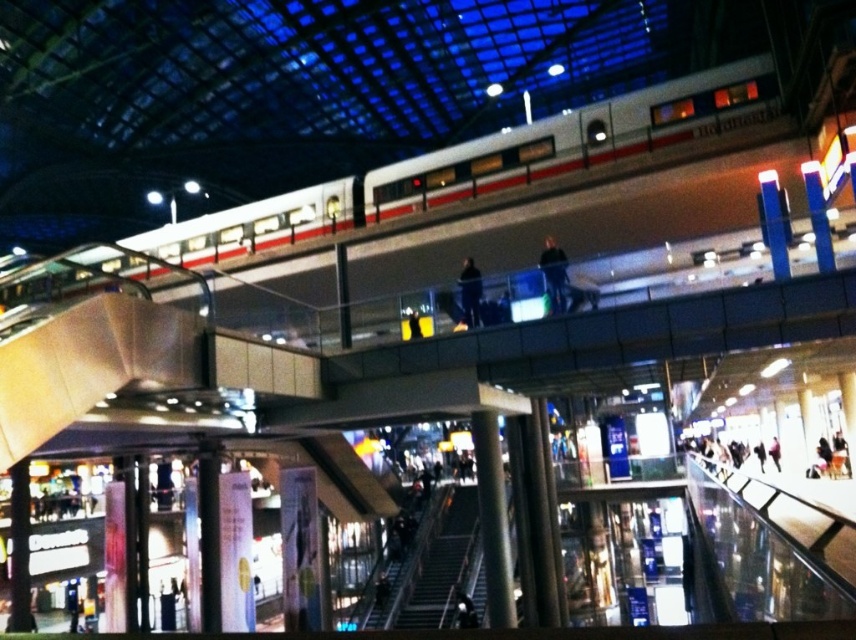
You are a passenger waiting at the train station and see the white glossy train at upper center and the dark blue fabric at upper center. Which object is bigger in size?

The white glossy train at upper center is larger in size compared to the dark blue fabric at upper center.

You are a passenger waiting at the train station and notice a white glossy train at upper center and a dark blue fabric jacket at upper center. Which object is wider from your perspective?

The white glossy train at upper center might be wider than dark blue fabric jacket at upper center according to the description.

You are a photographer trying to capture the dark blue fabric jacket at upper center and the dark blue fabric at upper center in the same frame. Which object should you focus on first to ensure both are in the frame?

You should focus on the dark blue fabric jacket at upper center first because its width surpasses the dark blue fabric at upper center, making it larger and easier to frame both objects.